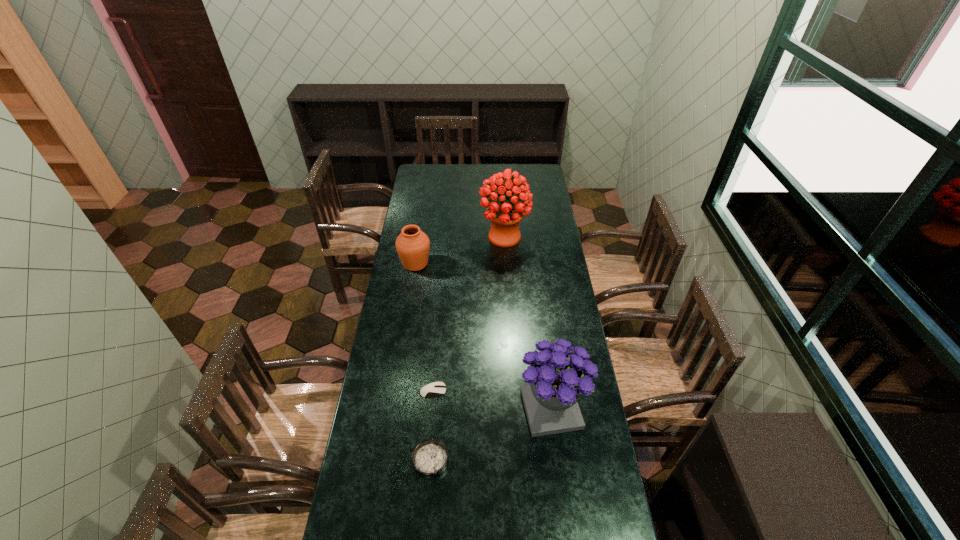
In order to click on vacant region between the mouse and the urn in this screenshot , I will do `click(424, 327)`.

Image resolution: width=960 pixels, height=540 pixels. I want to click on free point between the nearest object and the farther bouquet, so click(468, 349).

This screenshot has height=540, width=960. Identify the location of free space between the leftmost object and the nearest object. (423, 362).

This screenshot has height=540, width=960. Find the location of `free spot between the tallest object and the ashtray`. free spot between the tallest object and the ashtray is located at coordinates (468, 349).

Find the location of `empty space that is in between the second tallest object and the urn`. empty space that is in between the second tallest object and the urn is located at coordinates (484, 336).

You are a GUI agent. You are given a task and a screenshot of the screen. Output one action in this format:
    pyautogui.click(x=<x>, y=<y>)
    Task: Click on the unoccupied area between the urn and the tallest object
    Image resolution: width=960 pixels, height=540 pixels.
    Given the screenshot: What is the action you would take?
    pyautogui.click(x=460, y=250)

Find the location of a particular element. The width and height of the screenshot is (960, 540). free area in between the mouse and the urn is located at coordinates (424, 327).

The height and width of the screenshot is (540, 960). Find the location of `vacant area between the urn and the nearest object`. vacant area between the urn and the nearest object is located at coordinates (423, 362).

Find the location of a particular element. This screenshot has width=960, height=540. the fourth closest object to the nearest object is located at coordinates (505, 214).

You are a GUI agent. You are given a task and a screenshot of the screen. Output one action in this format:
    pyautogui.click(x=<x>, y=<y>)
    Task: Click on the second closest object to the farther bouquet
    The width and height of the screenshot is (960, 540).
    Given the screenshot: What is the action you would take?
    pyautogui.click(x=557, y=378)